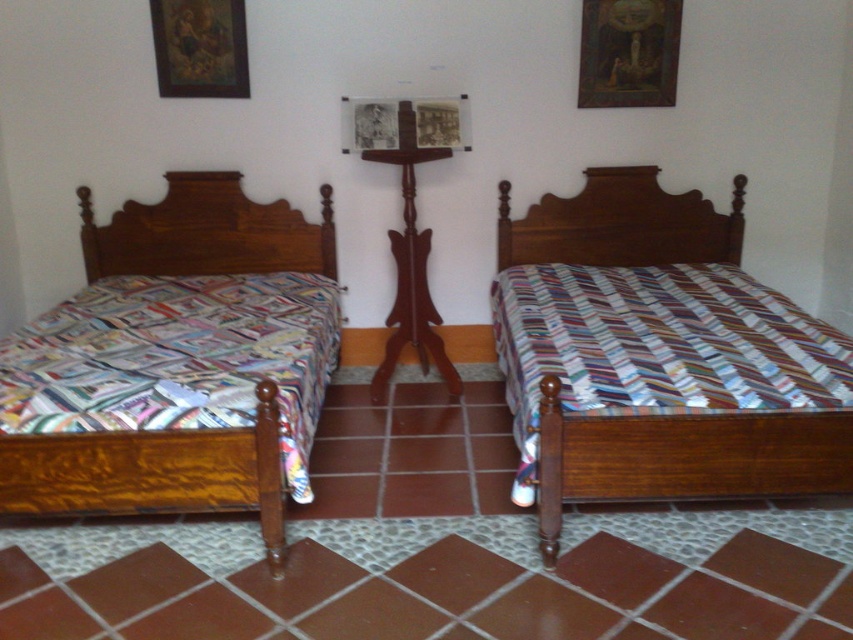
Question: Can you confirm if wooden picture frame at upper center is bigger than wooden picture frame at upper left?

Choices:
 (A) no
 (B) yes

Answer: (B)

Question: Among these objects, which one is nearest to the camera?

Choices:
 (A) wooden bed at center
 (B) wooden picture frame at upper center
 (C) wooden bed at left

Answer: (B)

Question: Among these points, which one is nearest to the camera?

Choices:
 (A) (637, 250)
 (B) (637, 88)
 (C) (265, 468)
 (D) (190, 93)

Answer: (C)

Question: Does wooden picture frame at upper center appear under wooden picture frame at upper left?

Choices:
 (A) yes
 (B) no

Answer: (B)

Question: Among these points, which one is farthest from the camera?

Choices:
 (A) (779, 484)
 (B) (96, 490)
 (C) (233, 13)
 (D) (611, 4)

Answer: (D)

Question: Is wooden bed at left below wooden bed at center?

Choices:
 (A) yes
 (B) no

Answer: (A)